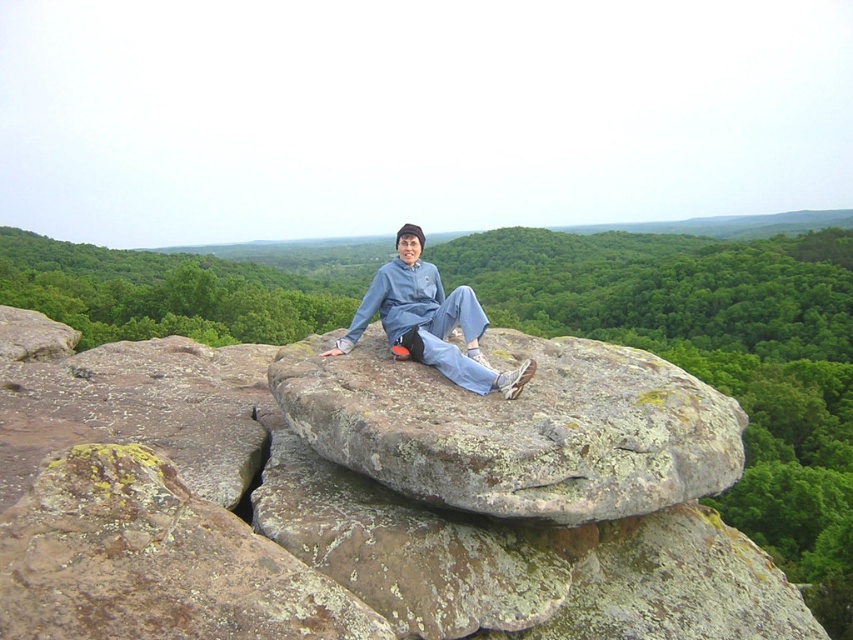
Between point (512, 368) and point (650, 444), which one is positioned in front?

Point (650, 444)

Does lichen-covered rock at center appear under gray lichen-covered rock at center?

Indeed, lichen-covered rock at center is positioned under gray lichen-covered rock at center.

Identify the location of lichen-covered rock at center. The width and height of the screenshot is (853, 640). (370, 496).

Is point (613, 624) closer to viewer compared to point (534, 368)?

Yes, it is in front of point (534, 368).

Is lichen-covered rock at center shorter than blue denim pants at center?

No, lichen-covered rock at center is not shorter than blue denim pants at center.

I want to click on lichen-covered rock at center, so click(370, 496).

Image resolution: width=853 pixels, height=640 pixels. I want to click on lichen-covered rock at center, so click(x=370, y=496).

Between gray lichen-covered rock at center and blue denim pants at center, which one appears on the left side from the viewer's perspective?

Positioned to the left is blue denim pants at center.

Does point (602, 401) come in front of point (357, 323)?

Yes, it is.

You are a GUI agent. You are given a task and a screenshot of the screen. Output one action in this format:
    pyautogui.click(x=<x>, y=<y>)
    Task: Click on the gray lichen-covered rock at center
    This screenshot has width=853, height=640.
    Given the screenshot: What is the action you would take?
    pyautogui.click(x=517, y=428)